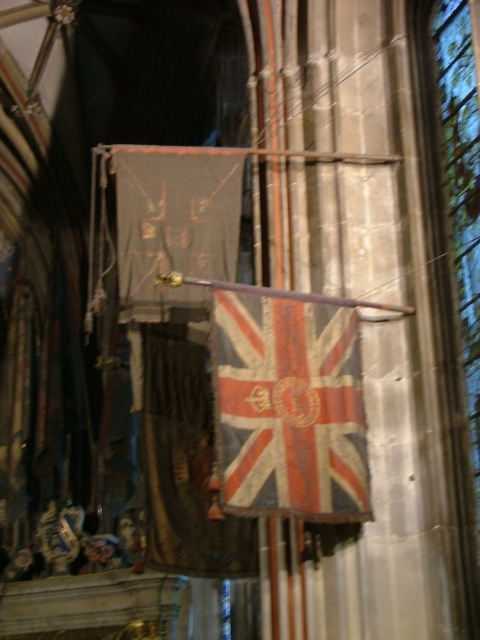
Does worn fabric flag at center appear over transparent stained glass at right?

No, worn fabric flag at center is not above transparent stained glass at right.

Between point (231, 324) and point (472, 198), which one is positioned behind?

The point (472, 198) is behind.

At what (x,y) coordinates should I click in order to perform the action: click on worn fabric flag at center. Please return your answer as a coordinate pair (x, y). Image resolution: width=480 pixels, height=640 pixels. Looking at the image, I should click on (288, 406).